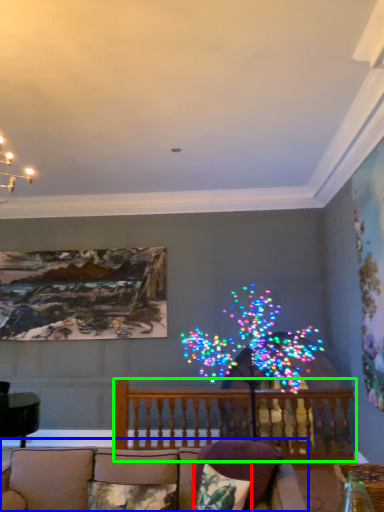
Question: Which object is positioned farthest from pillow (highlighted by a red box)? Select from studio couch (highlighted by a blue box) and balcony (highlighted by a green box).

Choices:
 (A) studio couch
 (B) balcony

Answer: (B)